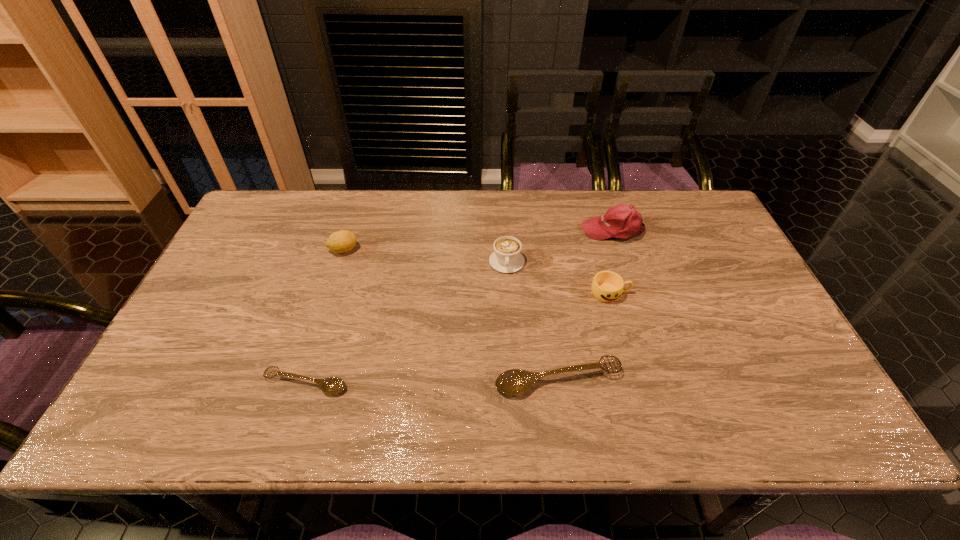
The width and height of the screenshot is (960, 540). What are the coordinates of `free space between the baseball cap and the fourth tallest object` in the screenshot? It's located at (x=612, y=261).

Where is `free space between the lemon and the shortest object`? The width and height of the screenshot is (960, 540). free space between the lemon and the shortest object is located at coordinates (324, 316).

Locate an element on the screen. free space between the shorter ladle and the fourth farthest object is located at coordinates (458, 339).

Choose which object is the second nearest neighbor to the cup. Please provide its 2D coordinates. Your answer should be formatted as a tuple, i.e. [(x, y)], where the tuple contains the x and y coordinates of a point satisfying the conditions above.

[(506, 258)]

What are the coordinates of `object that is the fourth closest to the fourth tallest object` in the screenshot? It's located at (333, 385).

Identify the location of free space that satisfies the following two spatial constraints: 1. at the stem end of the lemon; 2. on the back side of the shortest object. (301, 383).

Image resolution: width=960 pixels, height=540 pixels. I want to click on vacant space that satisfies the following two spatial constraints: 1. at the stem end of the lemon; 2. on the left side of the left ladle, so click(x=301, y=383).

Where is `vacant space that satisfies the following two spatial constraints: 1. at the stem end of the shortest object; 2. on the left side of the lemon`? The height and width of the screenshot is (540, 960). vacant space that satisfies the following two spatial constraints: 1. at the stem end of the shortest object; 2. on the left side of the lemon is located at coordinates (301, 383).

The width and height of the screenshot is (960, 540). What are the coordinates of `free location that satisfies the following two spatial constraints: 1. at the stem end of the lemon; 2. on the back side of the taller ladle` in the screenshot? It's located at (302, 380).

Image resolution: width=960 pixels, height=540 pixels. I want to click on vacant area in the image that satisfies the following two spatial constraints: 1. at the front of the baseball cap with the brim; 2. to the right of the cappuccino's handle, so click(x=623, y=262).